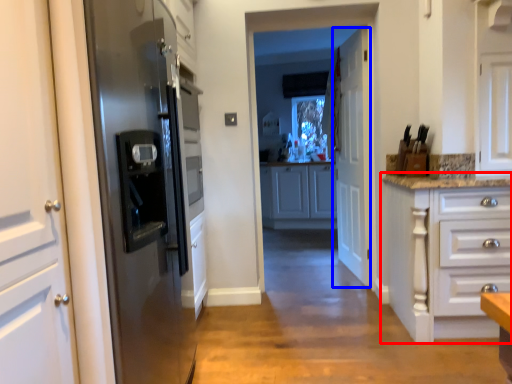
Question: Which object appears farthest to the camera in this image, cabinetry (highlighted by a red box) or door (highlighted by a blue box)?

Choices:
 (A) cabinetry
 (B) door

Answer: (B)